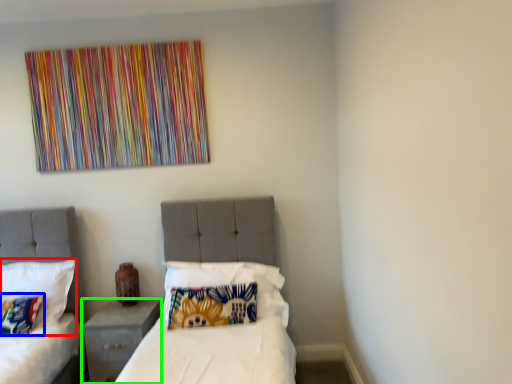
Question: Based on their relative distances, which object is nearer to pillow (highlighted by a red box)? Choose from pillow (highlighted by a blue box) and nightstand (highlighted by a green box).

Choices:
 (A) pillow
 (B) nightstand

Answer: (A)